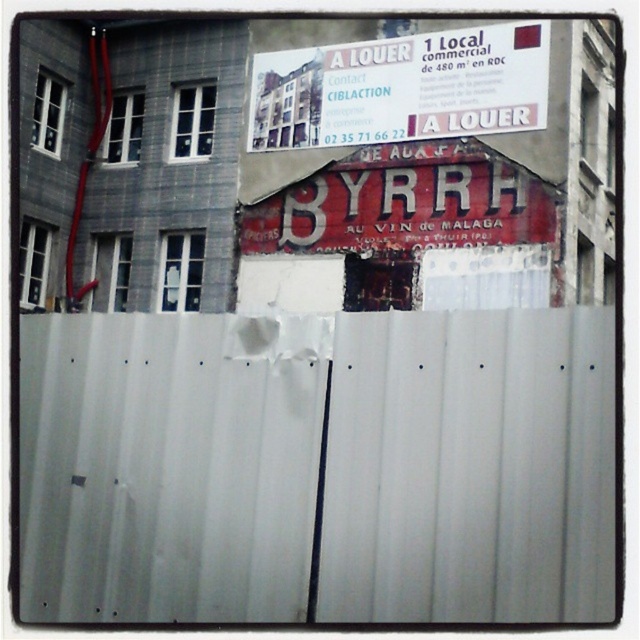
Question: Which is farther from the red painted wooden signboard at center?

Choices:
 (A) white corrugated metal fence at center
 (B) white paper sign at upper center

Answer: (A)

Question: Which point is farther from the camera taking this photo?

Choices:
 (A) (500, 61)
 (B) (221, 616)

Answer: (A)

Question: Can you confirm if white corrugated metal fence at center is positioned to the right of red painted wooden signboard at center?

Choices:
 (A) yes
 (B) no

Answer: (B)

Question: Where is white paper sign at upper center located in relation to red painted wooden signboard at center in the image?

Choices:
 (A) above
 (B) below

Answer: (A)

Question: Which point is farther to the camera?

Choices:
 (A) red painted wooden signboard at center
 (B) white paper sign at upper center

Answer: (B)

Question: Does white corrugated metal fence at center have a smaller size compared to white paper sign at upper center?

Choices:
 (A) yes
 (B) no

Answer: (B)